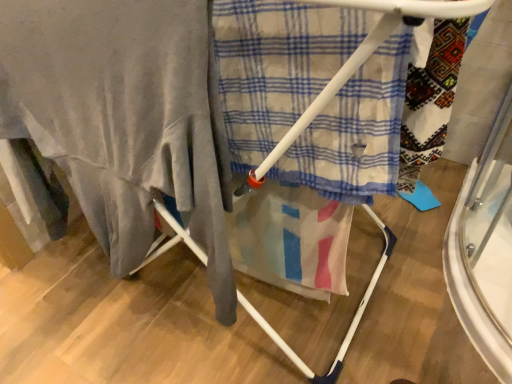
Question: Is white plastic drying rack at center inside the boundaries of plaid fabric at center, or outside?

Choices:
 (A) inside
 (B) outside

Answer: (B)

Question: From a real-world perspective, relative to plaid fabric at center, is white plastic drying rack at center vertically above or below?

Choices:
 (A) above
 (B) below

Answer: (B)

Question: Which of these objects is positioned closest to the white plastic drying rack at center?

Choices:
 (A) matte gray blanket at left
 (B) plaid fabric at center

Answer: (B)

Question: Which of these objects is positioned closest to the white plastic drying rack at center?

Choices:
 (A) matte gray blanket at left
 (B) plaid fabric at center

Answer: (B)